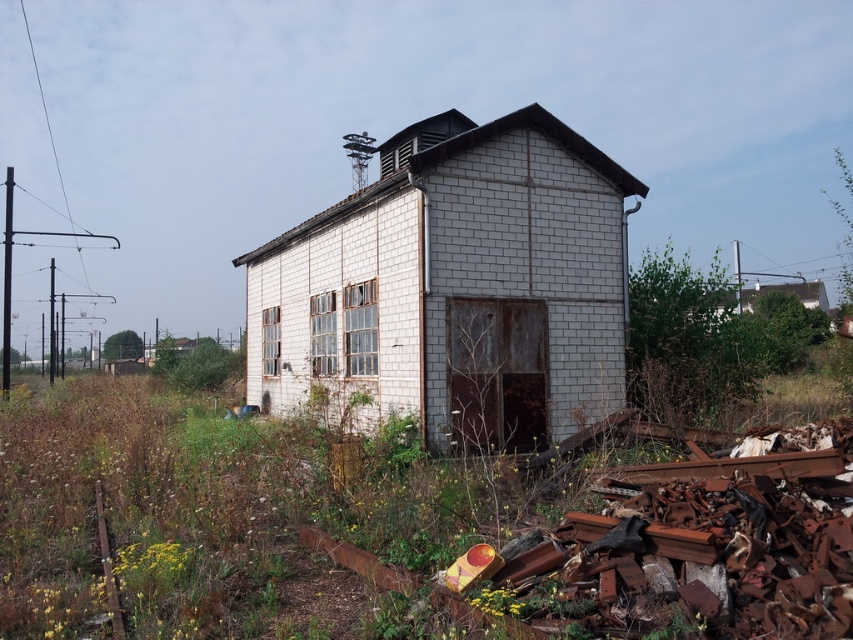
The width and height of the screenshot is (853, 640). Describe the element at coordinates (778, 291) in the screenshot. I see `white brick hut at upper right` at that location.

Image resolution: width=853 pixels, height=640 pixels. I want to click on white brick hut at upper right, so click(x=778, y=291).

Is white brick building at center thinner than white brick hut at upper right?

Yes.

You are a GUI agent. You are given a task and a screenshot of the screen. Output one action in this format:
    pyautogui.click(x=<x>, y=<y>)
    Task: Click on the white brick building at center
    The width and height of the screenshot is (853, 640).
    Given the screenshot: What is the action you would take?
    pyautogui.click(x=456, y=288)

The image size is (853, 640). What are the coordinates of `white brick building at center` in the screenshot? It's located at (456, 288).

Does white brick building at center appear under rusty metal train track at lower left?

No.

Is white brick building at center to the left of rusty metal train track at lower left from the viewer's perspective?

In fact, white brick building at center is to the right of rusty metal train track at lower left.

Find the location of `white brick building at center`. white brick building at center is located at coordinates (456, 288).